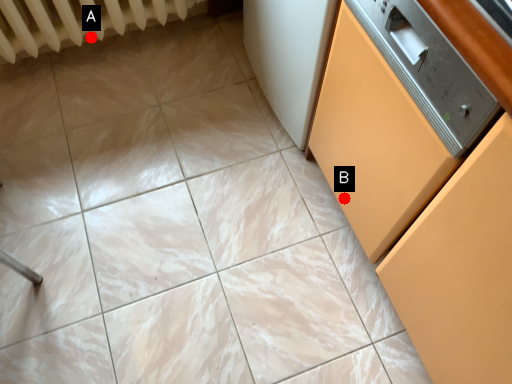
Question: Two points are circled on the image, labeled by A and B beside each circle. Among these points, which one is farthest from the camera?

Choices:
 (A) A is further
 (B) B is further

Answer: (A)